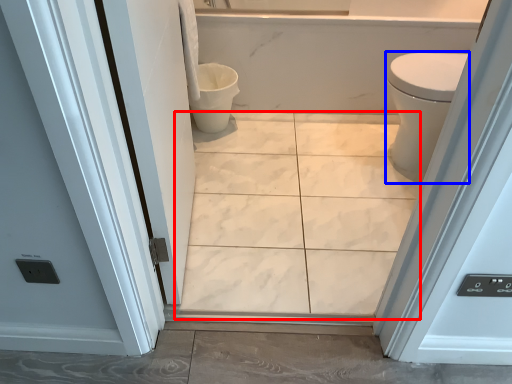
Question: Among these objects, which one is nearest to the camera, ceramic tile (highlighted by a red box) or bidet (highlighted by a blue box)?

Choices:
 (A) ceramic tile
 (B) bidet

Answer: (A)